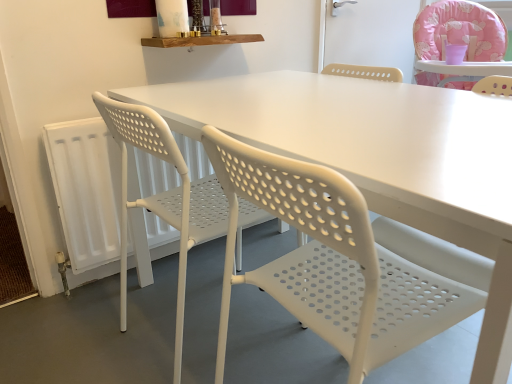
Question: From the image's perspective, is white perforated plastic chair at left, marked as the first chair in a left-to-right arrangement, under pink fabric highchair at upper right, arranged as the 3th chair when viewed from the left?

Choices:
 (A) yes
 (B) no

Answer: (A)

Question: Is white perforated plastic chair at left, marked as the first chair in a left-to-right arrangement, at the left side of pink fabric highchair at upper right, the first chair viewed from the right?

Choices:
 (A) no
 (B) yes

Answer: (B)

Question: Can you confirm if white perforated plastic chair at left, marked as the first chair in a left-to-right arrangement, is shorter than pink fabric highchair at upper right, the first chair viewed from the right?

Choices:
 (A) no
 (B) yes

Answer: (A)

Question: Considering the relative sizes of white perforated plastic chair at left, marked as the first chair in a left-to-right arrangement, and pink fabric highchair at upper right, the first chair viewed from the right, in the image provided, is white perforated plastic chair at left, marked as the first chair in a left-to-right arrangement, thinner than pink fabric highchair at upper right, the first chair viewed from the right,?

Choices:
 (A) no
 (B) yes

Answer: (B)

Question: Could you tell me if white perforated plastic chair at left, the third chair positioned from the right, is facing pink fabric highchair at upper right, the first chair viewed from the right?

Choices:
 (A) yes
 (B) no

Answer: (A)

Question: Is white perforated plastic chair at left, the third chair positioned from the right, closer to the viewer compared to pink fabric highchair at upper right, arranged as the 3th chair when viewed from the left?

Choices:
 (A) no
 (B) yes

Answer: (B)

Question: Is pink fabric highchair at upper right, the first chair viewed from the right, positioned far away from white perforated plastic chair at center, positioned as the 2th chair in right-to-left order?

Choices:
 (A) no
 (B) yes

Answer: (B)

Question: Is pink fabric highchair at upper right, arranged as the 3th chair when viewed from the left, further to camera compared to white perforated plastic chair at center, which is the second chair from left to right?

Choices:
 (A) no
 (B) yes

Answer: (B)

Question: Does pink fabric highchair at upper right, arranged as the 3th chair when viewed from the left, appear on the left side of white perforated plastic chair at center, which is the second chair from left to right?

Choices:
 (A) yes
 (B) no

Answer: (B)

Question: Considering the relative sizes of pink fabric highchair at upper right, arranged as the 3th chair when viewed from the left, and white perforated plastic chair at center, positioned as the 2th chair in right-to-left order, in the image provided, is pink fabric highchair at upper right, arranged as the 3th chair when viewed from the left, smaller than white perforated plastic chair at center, positioned as the 2th chair in right-to-left order,?

Choices:
 (A) no
 (B) yes

Answer: (A)

Question: Considering the relative positions of pink fabric highchair at upper right, arranged as the 3th chair when viewed from the left, and white perforated plastic chair at center, positioned as the 2th chair in right-to-left order, in the image provided, is pink fabric highchair at upper right, arranged as the 3th chair when viewed from the left, to the right of white perforated plastic chair at center, positioned as the 2th chair in right-to-left order, from the viewer's perspective?

Choices:
 (A) no
 (B) yes

Answer: (B)

Question: From the image's perspective, does pink fabric highchair at upper right, arranged as the 3th chair when viewed from the left, appear higher than white perforated plastic chair at center, which is the second chair from left to right?

Choices:
 (A) yes
 (B) no

Answer: (A)

Question: Does pink fabric highchair at upper right, the first chair viewed from the right, have a larger size compared to white plastic radiator at lower left?

Choices:
 (A) yes
 (B) no

Answer: (A)